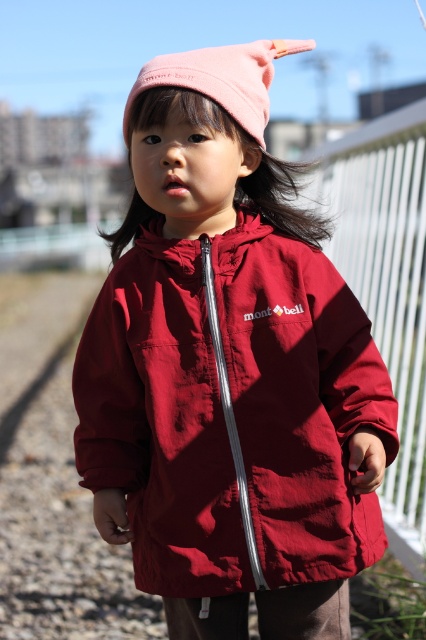
Question: Which object appears farthest from the camera in this image?

Choices:
 (A) burgundy fabric jacket at center
 (B) white plastic fence at right

Answer: (B)

Question: Does burgundy fabric jacket at center lie behind white plastic fence at right?

Choices:
 (A) no
 (B) yes

Answer: (A)

Question: Which point is closer to the camera taking this photo?

Choices:
 (A) (256, 108)
 (B) (371, 237)

Answer: (A)

Question: Is burgundy fabric jacket at center smaller than pink fabric hat at upper center?

Choices:
 (A) no
 (B) yes

Answer: (A)

Question: Which of the following is the closest to the observer?

Choices:
 (A) (273, 288)
 (B) (334, 168)

Answer: (A)

Question: Is burgundy fabric jacket at center thinner than white plastic fence at right?

Choices:
 (A) no
 (B) yes

Answer: (A)